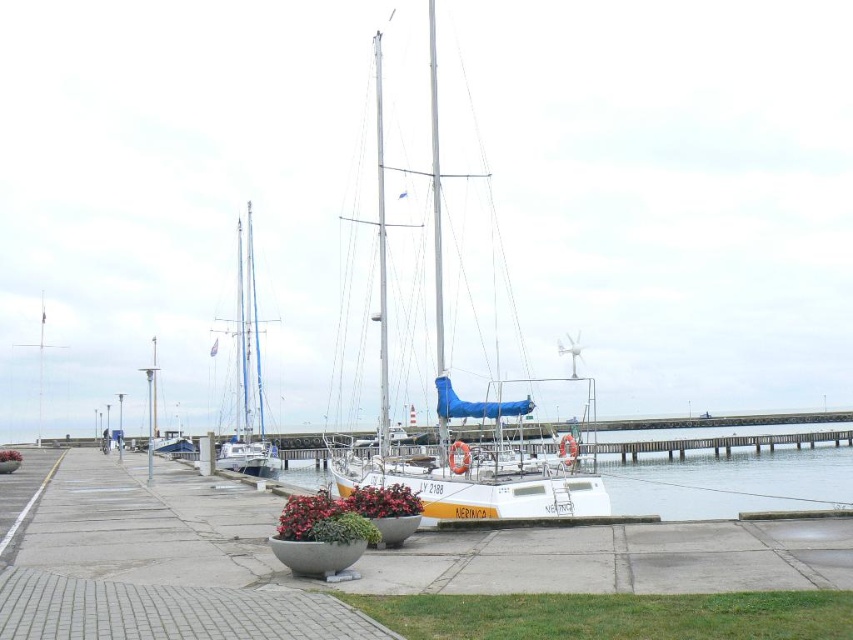
Question: Which point appears closest to the camera in this image?

Choices:
 (A) (521, 486)
 (B) (677, 451)

Answer: (A)

Question: Which of the following is the farthest from the observer?

Choices:
 (A) (581, 502)
 (B) (679, 465)
 (C) (256, 369)

Answer: (C)

Question: Is white water at center closer to the viewer compared to white glossy sailboat at left?

Choices:
 (A) yes
 (B) no

Answer: (A)

Question: Can you confirm if white water at center is positioned below white glossy sailboat at left?

Choices:
 (A) yes
 (B) no

Answer: (A)

Question: Does white sailboat at center appear under white water at center?

Choices:
 (A) yes
 (B) no

Answer: (B)

Question: Estimate the real-world distances between objects in this image. Which object is closer to the white sailboat at center?

Choices:
 (A) white water at center
 (B) white glossy sailboat at left

Answer: (B)